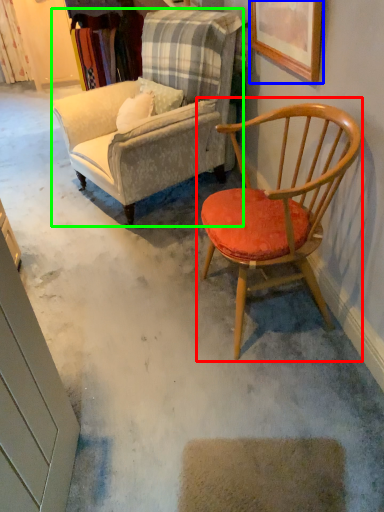
Question: Which is farther away from chair (highlighted by a red box)? picture frame (highlighted by a blue box) or chair (highlighted by a green box)?

Choices:
 (A) picture frame
 (B) chair

Answer: (B)